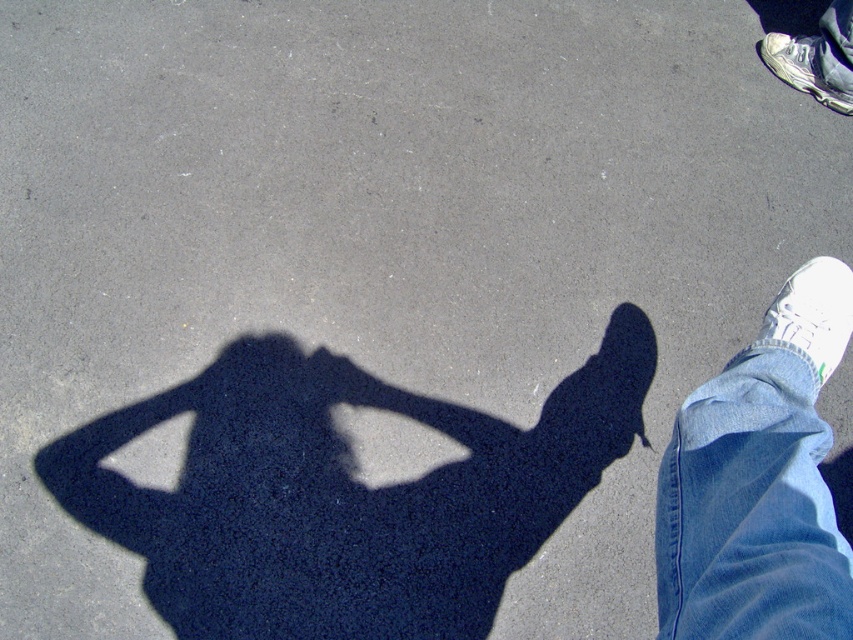
You are a fashion designer observing the shadow of a person in the image. You notice the blue denim jeans at lower right and the white leather shoe at upper right. Which of these items appears bigger in size when viewed from above?

The blue denim jeans at lower right has a larger size compared to the white leather shoe at upper right, so the blue denim jeans at lower right appears bigger in size when viewed from above.

In the scene shown: You are a photographer trying to capture the shadow of the person in the image. You notice the blue denim jeans at lower right and the white leather shoe at upper right in the shadow. Which object in the shadow appears taller?

The blue denim jeans at lower right appears much taller than the white leather shoe at upper right in the shadow.

You are a drone operator trying to locate the blue denim jeans at lower right in a birdseye view image. What coordinates should you adjust your camera to focus on?

The blue denim jeans at lower right are located at coordinates point [750,509], so you should adjust your camera to focus on those coordinates.